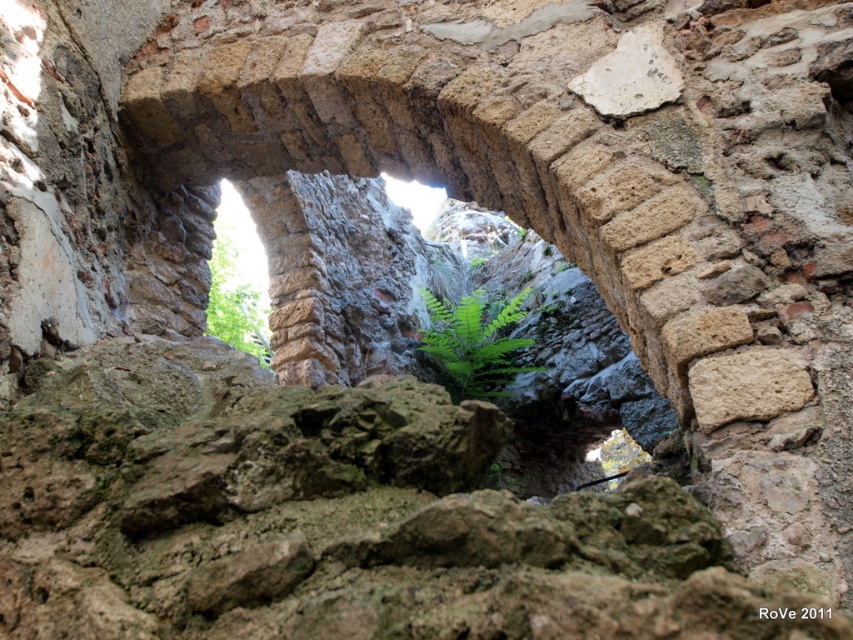
Where is `natural stone archway at center`? The height and width of the screenshot is (640, 853). natural stone archway at center is located at coordinates (450, 300).

Is point (579, 317) more distant than point (488, 362)?

Yes, point (579, 317) is behind point (488, 362).

Locate an element on the screen. Image resolution: width=853 pixels, height=640 pixels. natural stone archway at center is located at coordinates (450, 300).

Does point (311, 284) come behind point (228, 266)?

No.

Does natural stone archway at center appear on the right side of green leafy plant at upper left?

Indeed, natural stone archway at center is positioned on the right side of green leafy plant at upper left.

Does point (564, 365) come closer to viewer compared to point (224, 259)?

Yes, point (564, 365) is closer to viewer.

This screenshot has height=640, width=853. In order to click on natural stone archway at center in this screenshot , I will do (x=450, y=300).

Can you confirm if green leafy fern at center is thinner than green leafy plant at upper left?

Yes.

Which is behind, point (494, 330) or point (218, 321)?

Positioned behind is point (218, 321).

This screenshot has height=640, width=853. Identify the location of green leafy fern at center. (474, 342).